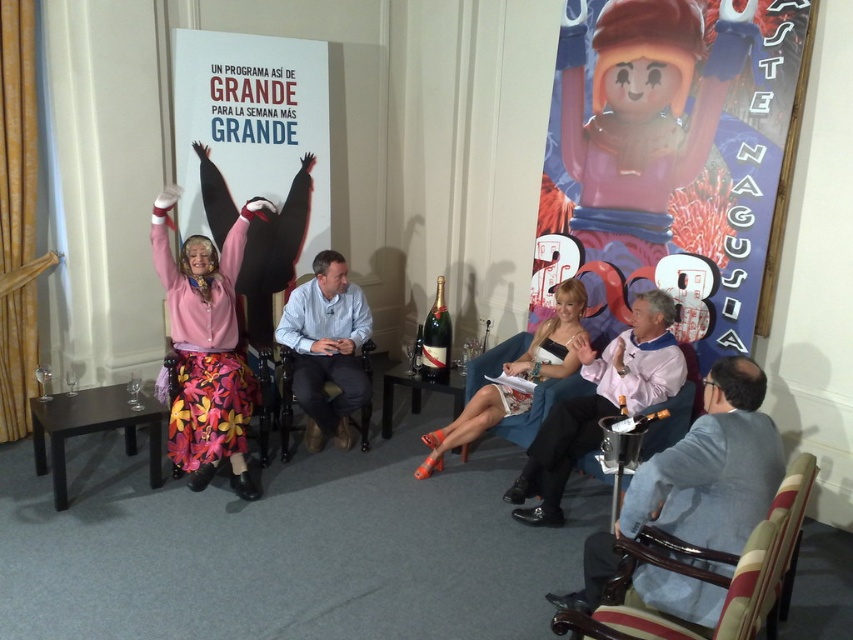
Question: Can you confirm if gray suit at lower right is positioned below pink fabric shirt at center?

Choices:
 (A) yes
 (B) no

Answer: (A)

Question: Considering the relative positions of gray suit at lower right and pink matte sweater at left in the image provided, where is gray suit at lower right located with respect to pink matte sweater at left?

Choices:
 (A) below
 (B) above

Answer: (A)

Question: Which object is farther from the camera taking this photo?

Choices:
 (A) white satin dress at center
 (B) matte pink fabric at upper left

Answer: (B)

Question: Which object is farther from the camera taking this photo?

Choices:
 (A) floral fabric armchair at center
 (B) pink matte sweater at left
 (C) green glass bottle at center

Answer: (C)

Question: Estimate the real-world distances between objects in this image. Which object is closer to the light blue shirt at center?

Choices:
 (A) translucent plastic lego figure at right
 (B) floral fabric armchair at center
 (C) white satin dress at center

Answer: (B)

Question: Does pink fabric shirt at center appear over white satin dress at center?

Choices:
 (A) no
 (B) yes

Answer: (A)